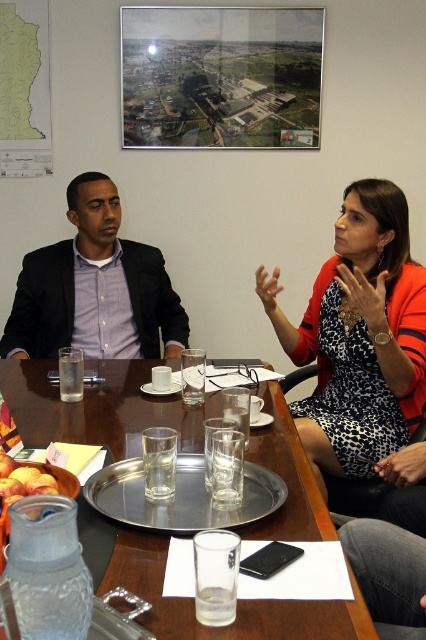
You are a server who needs to place a 12 inch long tray of drinks between the two people at the wooden table at center. Can you fit the tray between them without moving either person?

The two people are 31.05 inches apart, so yes, the 12 inch tray can fit between them comfortably.